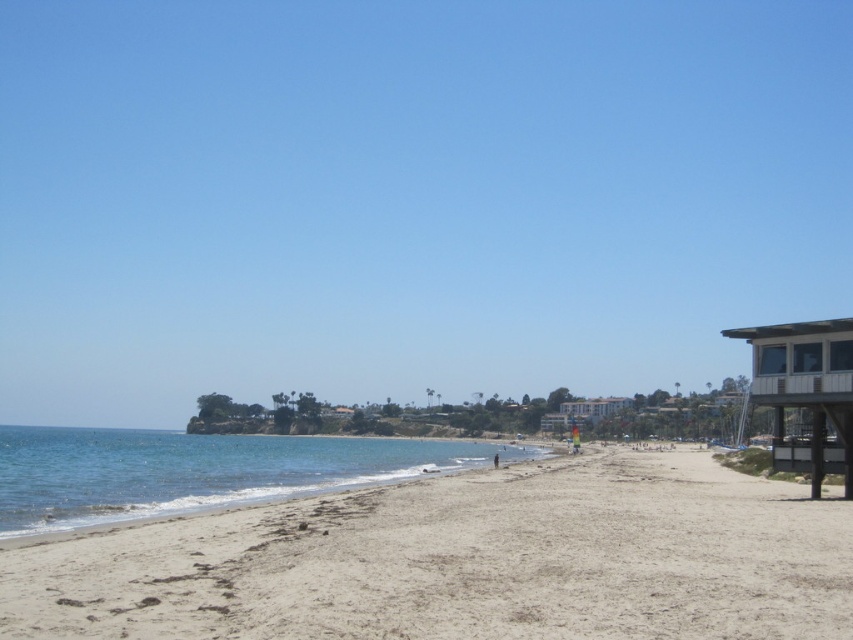
Is light beige sand at lower center closer to camera compared to clear blue water at lower left?

Yes, light beige sand at lower center is in front of clear blue water at lower left.

Does light beige sand at lower center have a greater height compared to clear blue water at lower left?

Incorrect, light beige sand at lower center's height is not larger of clear blue water at lower left's.

Where is `light beige sand at lower center`? light beige sand at lower center is located at coordinates (462, 561).